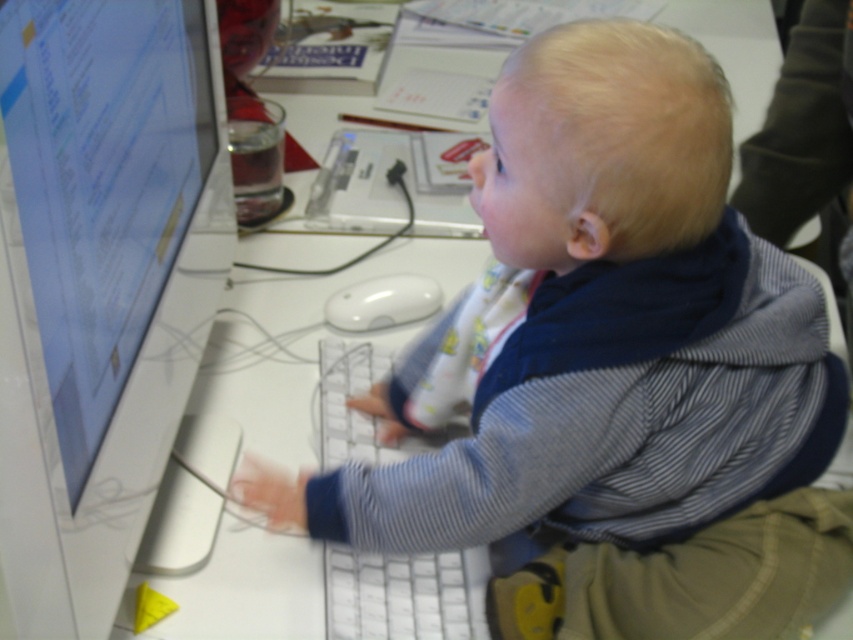
Question: Does white glossy monitor at left have a larger size compared to white plastic keyboard at center?

Choices:
 (A) no
 (B) yes

Answer: (A)

Question: Which point is farther to the camera?

Choices:
 (A) striped cotton shirt at center
 (B) white matte mouse at center
 (C) white glossy monitor at left

Answer: (B)

Question: Is white glossy monitor at left to the right of white matte mouse at center from the viewer's perspective?

Choices:
 (A) no
 (B) yes

Answer: (A)

Question: Which object is the farthest from the white plastic keyboard at center?

Choices:
 (A) striped cotton shirt at center
 (B) white glossy monitor at left
 (C) white matte mouse at center

Answer: (B)

Question: Estimate the real-world distances between objects in this image. Which object is farther from the striped cotton shirt at center?

Choices:
 (A) white plastic keyboard at center
 (B) white matte mouse at center
 (C) white glossy monitor at left

Answer: (B)

Question: Can you confirm if white plastic keyboard at center is thinner than white matte mouse at center?

Choices:
 (A) no
 (B) yes

Answer: (A)